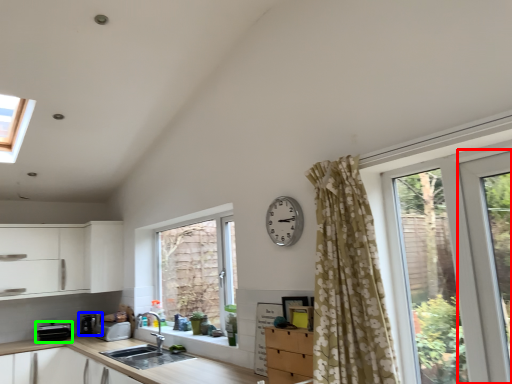
Question: Estimate the real-world distances between objects in this image. Which object is farther from screen door (highlighted by a red box), appliance (highlighted by a blue box) or appliance (highlighted by a green box)?

Choices:
 (A) appliance
 (B) appliance

Answer: (B)